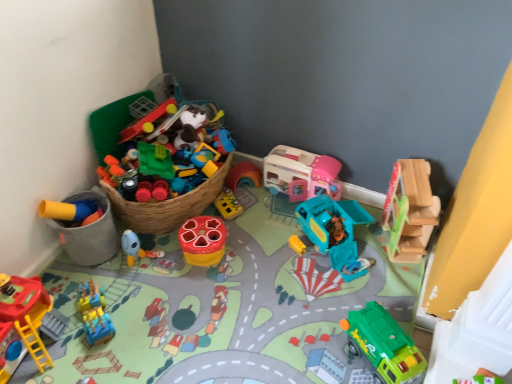
Locate an element on the screen. free space between green matte truck at lower right, arranged as the second toy when viewed from the right, and teal plastic truck at center, which is the 6th toy in left-to-right order is located at coordinates (346, 290).